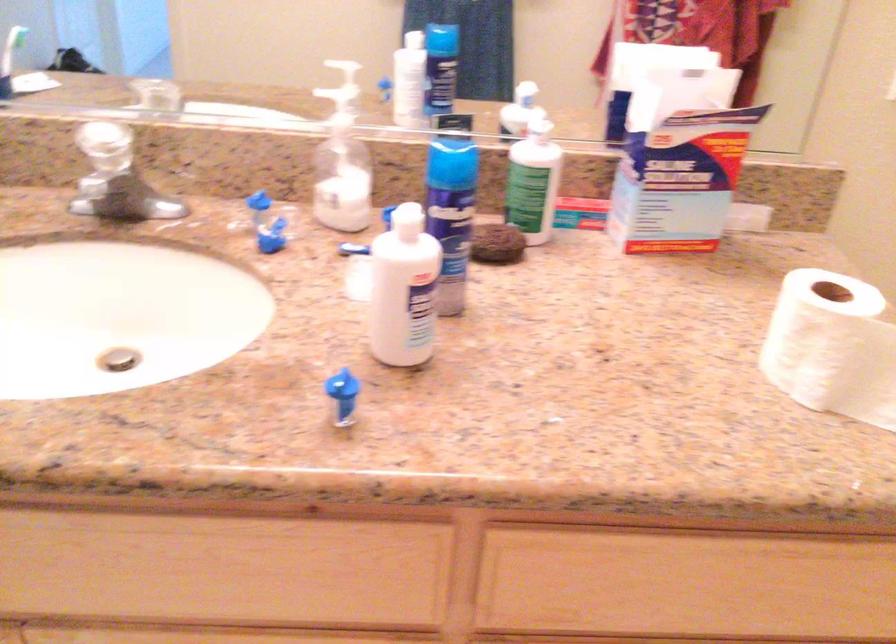
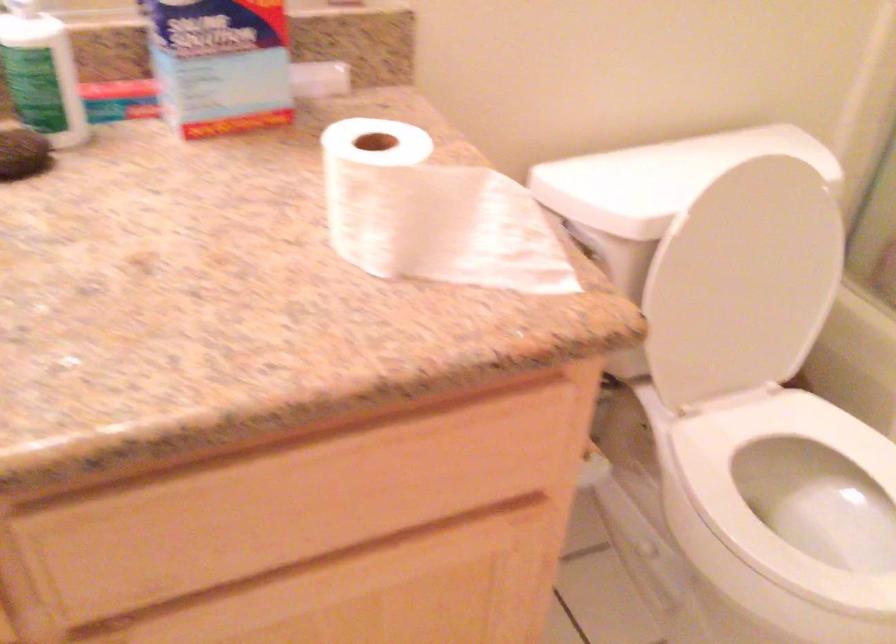
Which direction would the cameraman need to move to produce the second image?

The movement direction of the cameraman is right, forward.